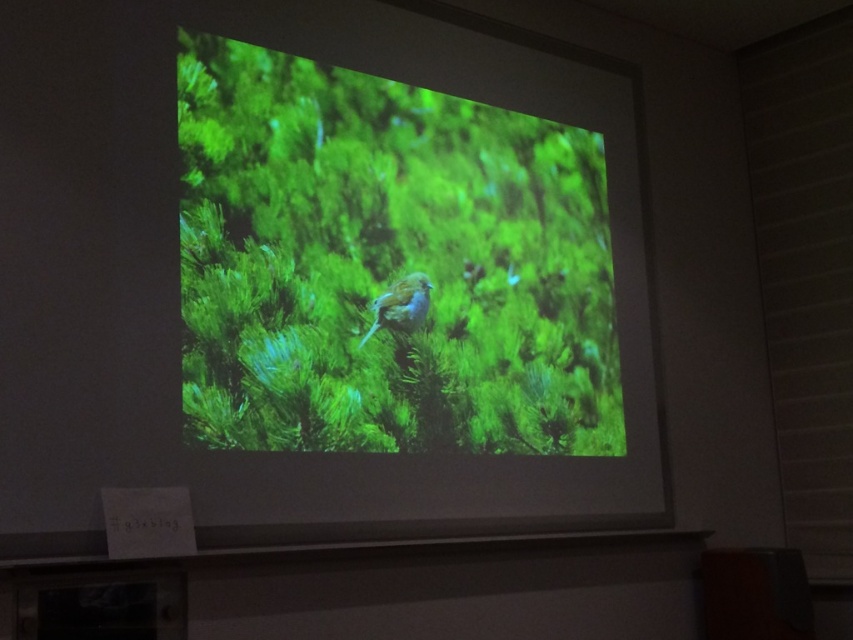
You are an artist who wants to sketch the scene. You notice the green leafy plant at center and the blue feathered bird at center. Which object should you focus on first if you want to draw the larger one?

The green leafy plant at center is bigger than the blue feathered bird at center, so you should focus on the green leafy plant at center first.

You are an art student analyzing the composition of the image. Which object, the green leafy plant at center or the blue feathered bird at center, is positioned in front of the other?

The green leafy plant at center is closer to the viewer than the blue feathered bird at center, so it is positioned in front of the bird.